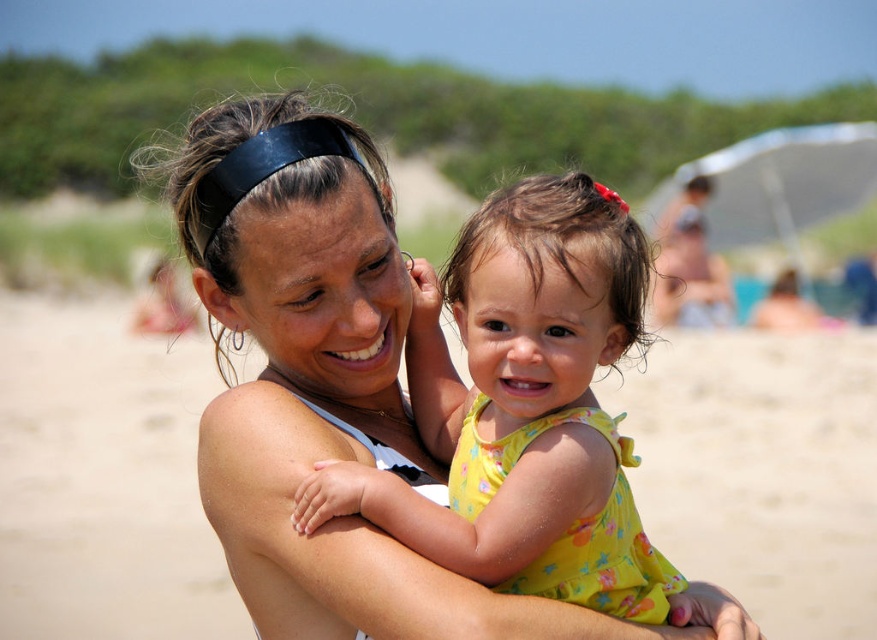
Can you confirm if beige sand at center is thinner than yellow floral dress at center?

No, beige sand at center is not thinner than yellow floral dress at center.

Does point (34, 477) lie in front of point (537, 580)?

No, it is not.

What do you see at coordinates (103, 477) in the screenshot? The width and height of the screenshot is (877, 640). I see `beige sand at center` at bounding box center [103, 477].

The height and width of the screenshot is (640, 877). Identify the location of beige sand at center. (103, 477).